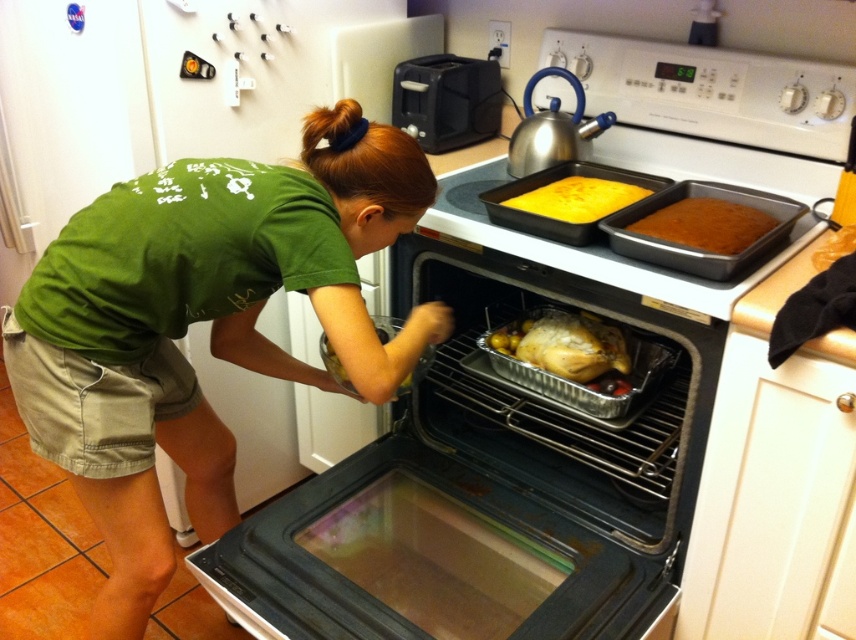
You are a delivery person who just arrived at the house. You need to place a silver metallic turkey at center on the kitchen counter near the oven. According to the image, where exactly should you place it?

The silver metallic turkey at center should be placed at the coordinates point [565,346] according to the image.

You are a chef preparing a Thanksgiving feast. You have a silver metallic turkey at center and a golden brown roasted chicken at center in the oven. Which one is shorter?

The silver metallic turkey at center is shorter than the golden brown roasted chicken at center.

You are trying to fit both the silver metallic turkey at center and the golden brown roasted chicken at center into an oven that can only accommodate one object at a time. Based on their sizes, which one should you choose to ensure it fits properly?

The silver metallic turkey at center might be wider than golden brown roasted chicken at center, so you should choose the golden brown roasted chicken at center to ensure it fits properly in the oven.